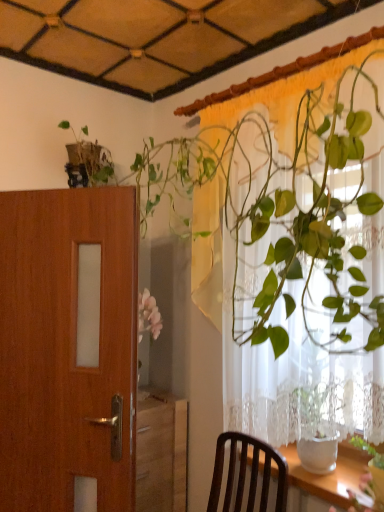
Question: From the image's perspective, is green leafy plant at upper right on top of green glossy plant at upper right?

Choices:
 (A) yes
 (B) no

Answer: (A)

Question: From a real-world perspective, is green leafy plant at upper right on top of green glossy plant at upper right?

Choices:
 (A) no
 (B) yes

Answer: (B)

Question: Is green leafy plant at upper right facing towards green glossy plant at upper right?

Choices:
 (A) no
 (B) yes

Answer: (B)

Question: Would you say green leafy plant at upper right is a long distance from green glossy plant at upper right?

Choices:
 (A) no
 (B) yes

Answer: (A)

Question: From a real-world perspective, is green leafy plant at upper right below green glossy plant at upper right?

Choices:
 (A) yes
 (B) no

Answer: (B)

Question: Visually, is wooden door at left positioned to the left or to the right of green glossy plant at upper right?

Choices:
 (A) left
 (B) right

Answer: (A)

Question: Considering the positions of point (33, 508) and point (269, 131), is point (33, 508) closer or farther from the camera than point (269, 131)?

Choices:
 (A) farther
 (B) closer

Answer: (A)

Question: From the image's perspective, relative to green glossy plant at upper right, is wooden door at left above or below?

Choices:
 (A) below
 (B) above

Answer: (A)

Question: Is wooden door at left inside the boundaries of green glossy plant at upper right, or outside?

Choices:
 (A) outside
 (B) inside

Answer: (A)

Question: Visually, is green leafy plant at upper right positioned to the left or to the right of green glossy plant at upper right?

Choices:
 (A) left
 (B) right

Answer: (B)

Question: In terms of width, does green leafy plant at upper right look wider or thinner when compared to green glossy plant at upper right?

Choices:
 (A) wide
 (B) thin

Answer: (B)

Question: From the image's perspective, relative to green glossy plant at upper right, is green leafy plant at upper right above or below?

Choices:
 (A) below
 (B) above

Answer: (B)

Question: Which is correct: green leafy plant at upper right is inside green glossy plant at upper right, or outside of it?

Choices:
 (A) outside
 (B) inside

Answer: (A)

Question: From the image's perspective, is green leafy plant at upper right positioned above or below wooden door at left?

Choices:
 (A) above
 (B) below

Answer: (A)

Question: Relative to wooden door at left, is green leafy plant at upper right in front or behind?

Choices:
 (A) front
 (B) behind

Answer: (A)